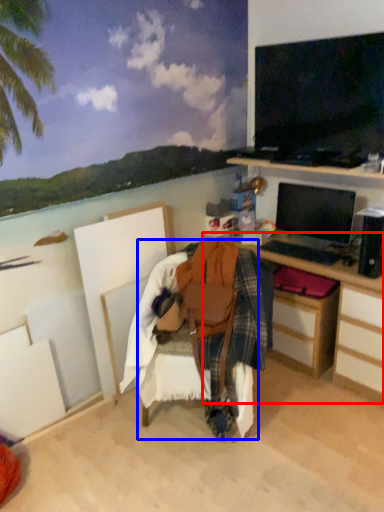
Question: Which object appears farthest to the camera in this image, desk (highlighted by a red box) or chair (highlighted by a blue box)?

Choices:
 (A) desk
 (B) chair

Answer: (A)